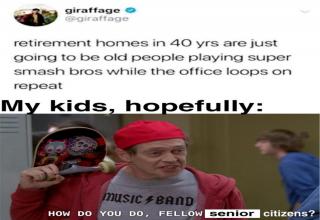
In order to click on office in this screenshot , I will do point(190,68).